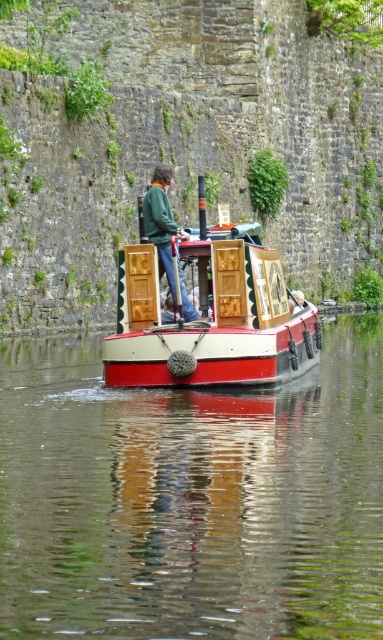
You are standing on the dock and see the wooden cabin cruiser at center and the green matte jacket at center. Which object is positioned to the right of the other?

The wooden cabin cruiser at center is to the right of the green matte jacket at center.